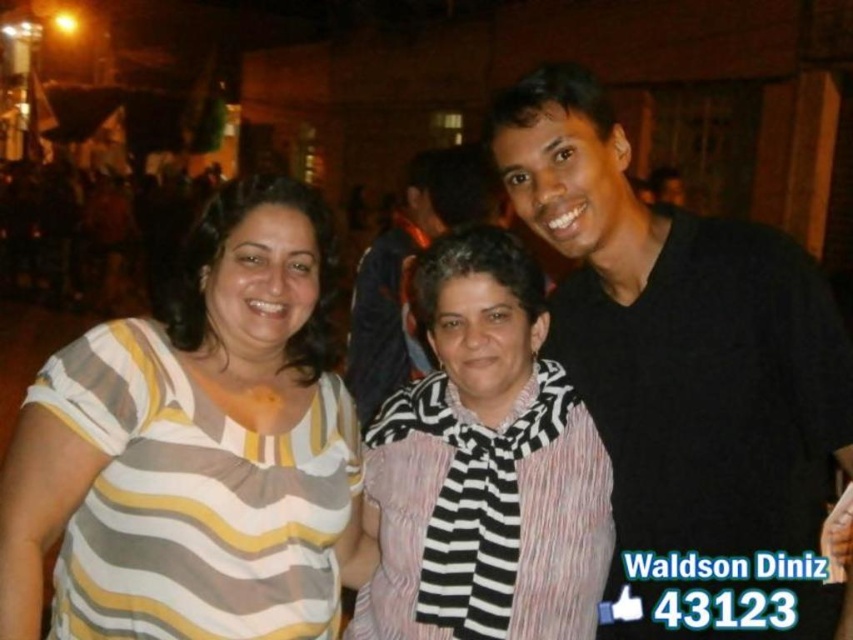
Is striped fabric shirt at center to the left of black matte shirt at center from the viewer's perspective?

Correct, you'll find striped fabric shirt at center to the left of black matte shirt at center.

Can you confirm if striped fabric shirt at center is positioned below black matte shirt at center?

Yes, striped fabric shirt at center is below black matte shirt at center.

Where is `striped fabric shirt at center`? The height and width of the screenshot is (640, 853). striped fabric shirt at center is located at coordinates (193, 448).

Where is `striped fabric shirt at center`? The width and height of the screenshot is (853, 640). striped fabric shirt at center is located at coordinates (193, 448).

Does striped fabric shirt at center appear over striped fabric scarf at center?

Yes, striped fabric shirt at center is above striped fabric scarf at center.

Find the location of a particular element. The width and height of the screenshot is (853, 640). striped fabric shirt at center is located at coordinates (193, 448).

Is black matte shirt at right below striped fabric scarf at center?

Incorrect, black matte shirt at right is not positioned below striped fabric scarf at center.

Is point (773, 417) farther from viewer compared to point (514, 524)?

No, it is in front of (514, 524).

The width and height of the screenshot is (853, 640). Identify the location of black matte shirt at right. (685, 378).